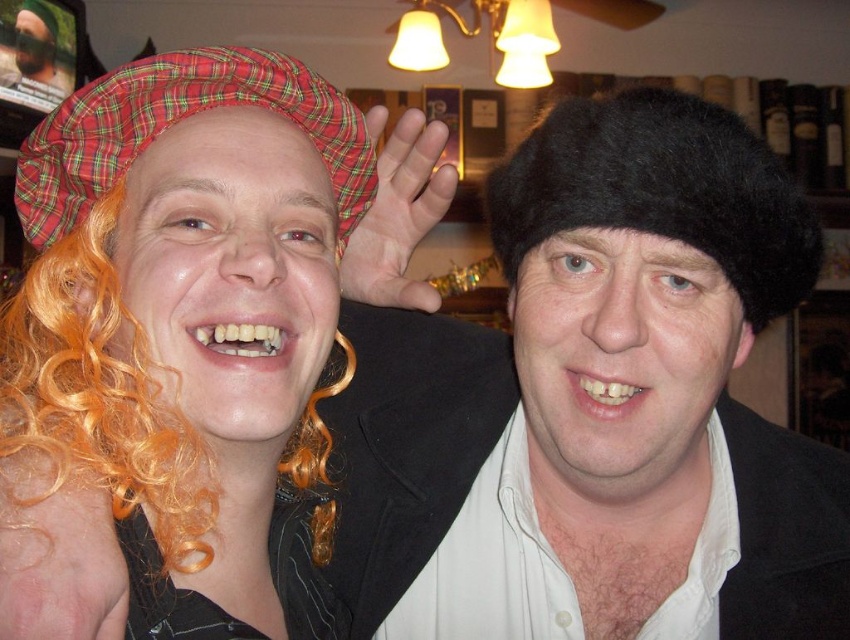
In the scene shown: You are taking a photo of the orange curly wig at left and need to ensure it is centered in the frame. Given its current position at coordinates point 0.613, 0.118, what adjustment should you make to the camera to center it?

The orange curly wig at left is located at point (99, 392). To center it, adjust the camera so the wig moves towards the center coordinates, which would require moving it left and up slightly depending on the frame dimensions.

You are a photographer trying to capture a group photo of the black fuzzy hat at upper right and the plaid fabric hat at upper left. The camera you are using has a minimum focus distance of 8 inches. Can you take a photo of both hats clearly without moving either of them?

The distance between the black fuzzy hat at upper right and plaid fabric hat at upper left is 8.18 inches. Since the minimum focus distance is 8 inches, the camera can focus on both hats as the distance is just over the required minimum.

Consider the image. You are a photographer adjusting your camera settings. You want to capture a clear photo of the point at coordinates point (38, 328) in the image. The camera has a depth of field that can focus clearly on objects within 70 cm. Will the point be in focus?

The point (38, 328) is 69.87 centimeters away from the camera, which is within the 70 cm depth of field range. Therefore, the point will be in focus.